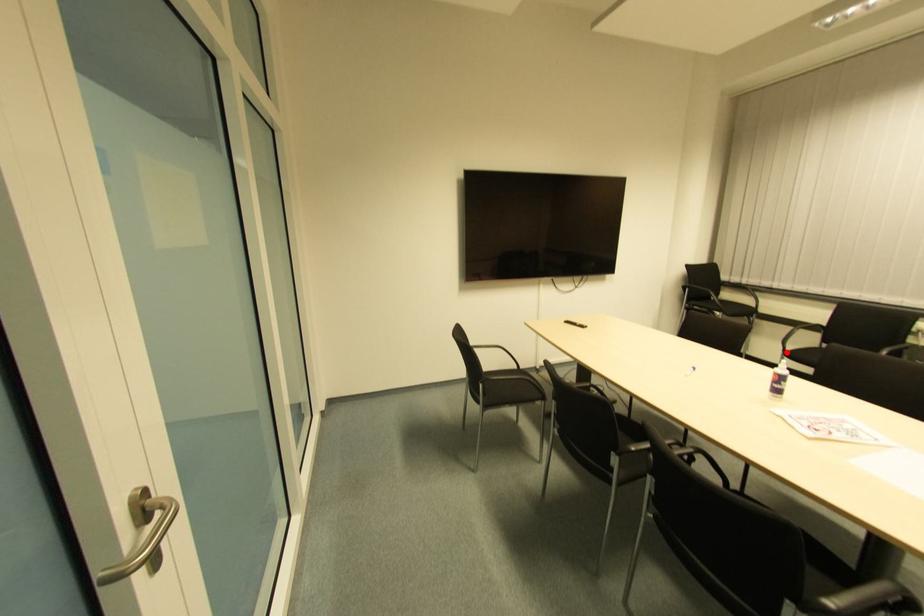
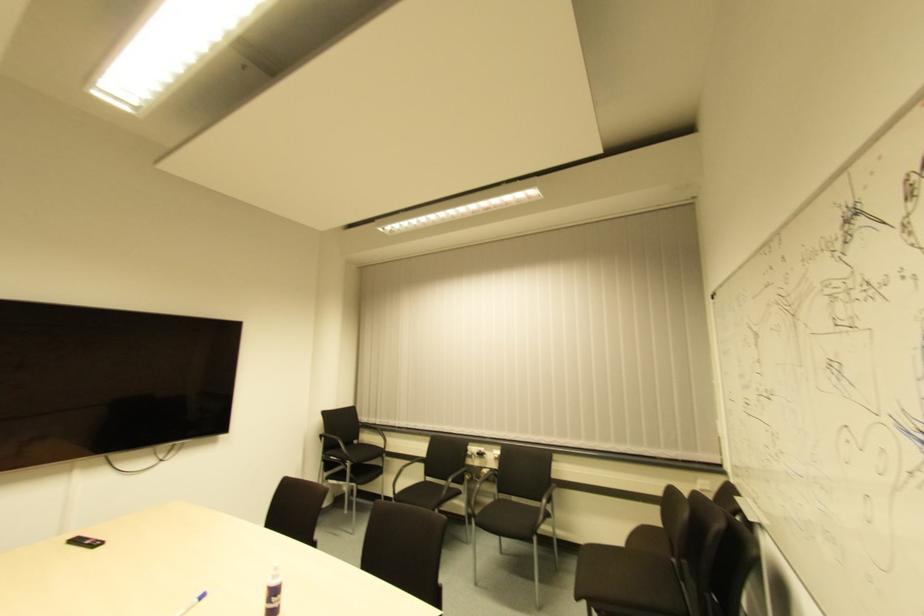
The point at the highlighted location is marked in the first image. Where is the corresponding point in the second image?

(395, 495)